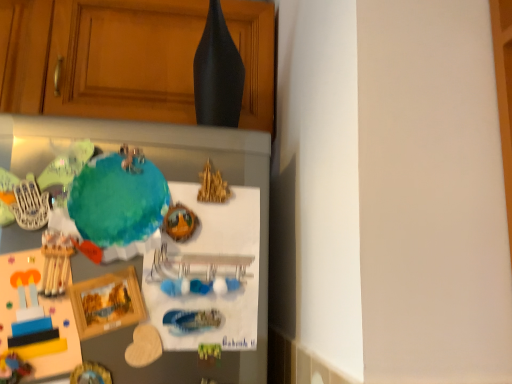
In order to face matte wood cabinet at upper center, should I rotate leftwards or rightwards?

To align with it, rotate left about 17.480°.

This screenshot has height=384, width=512. Describe the element at coordinates (101, 57) in the screenshot. I see `matte wood cabinet at upper center` at that location.

The height and width of the screenshot is (384, 512). What are the coordinates of `matte wood cabinet at upper center` in the screenshot? It's located at (101, 57).

Identify the location of teal matte globe at center. Image resolution: width=512 pixels, height=384 pixels. (118, 199).

Describe the element at coordinates (118, 199) in the screenshot. I see `teal matte globe at center` at that location.

The width and height of the screenshot is (512, 384). What are the coordinates of `matte wood cabinet at upper center` in the screenshot? It's located at (101, 57).

Would you say matte wood cabinet at upper center is to the left or to the right of teal matte globe at center in the picture?

matte wood cabinet at upper center is positioned on teal matte globe at center's left side.

Between matte wood cabinet at upper center and teal matte globe at center, which one is positioned behind?

matte wood cabinet at upper center is more distant.

Does point (56, 48) lie in front of point (102, 188)?

No.

From the image's perspective, between matte wood cabinet at upper center and teal matte globe at center, who is located below?

From the image's view, teal matte globe at center is below.

From a real-world perspective, who is located higher, matte wood cabinet at upper center or teal matte globe at center?

In real-world perspective, matte wood cabinet at upper center is above.

Considering the relative sizes of matte wood cabinet at upper center and teal matte globe at center in the image provided, is matte wood cabinet at upper center wider than teal matte globe at center?

Indeed, matte wood cabinet at upper center has a greater width compared to teal matte globe at center.

From the picture: Is matte wood cabinet at upper center taller than teal matte globe at center?

Indeed, matte wood cabinet at upper center has a greater height compared to teal matte globe at center.

Considering the relative sizes of matte wood cabinet at upper center and teal matte globe at center in the image provided, is matte wood cabinet at upper center smaller than teal matte globe at center?

Incorrect, matte wood cabinet at upper center is not smaller in size than teal matte globe at center.

Can we say matte wood cabinet at upper center lies outside teal matte globe at center?

Indeed, matte wood cabinet at upper center is completely outside teal matte globe at center.

Consider the image. Is matte wood cabinet at upper center beside teal matte globe at center?

No, matte wood cabinet at upper center is not in contact with teal matte globe at center.

Does matte wood cabinet at upper center turn towards teal matte globe at center?

No, matte wood cabinet at upper center is not oriented towards teal matte globe at center.

How much distance is there between matte wood cabinet at upper center and teal matte globe at center?

matte wood cabinet at upper center and teal matte globe at center are 18.86 inches apart.

Locate an element on the screen. This screenshot has width=512, height=384. cabinetry above the teal matte globe at center (from the image's perspective) is located at coordinates (101, 57).

Between teal matte globe at center and matte wood cabinet at upper center, which one appears on the right side from the viewer's perspective?

teal matte globe at center.

Considering the positions of objects teal matte globe at center and matte wood cabinet at upper center in the image provided, who is in front, teal matte globe at center or matte wood cabinet at upper center?

Positioned in front is teal matte globe at center.

Is point (90, 169) farther from viewer compared to point (127, 32)?

No, it is not.

From the image's perspective, which object appears higher, teal matte globe at center or matte wood cabinet at upper center?

matte wood cabinet at upper center.

From a real-world perspective, who is located lower, teal matte globe at center or matte wood cabinet at upper center?

In real-world perspective, teal matte globe at center is lower.

Considering the relative sizes of teal matte globe at center and matte wood cabinet at upper center in the image provided, is teal matte globe at center wider than matte wood cabinet at upper center?

Incorrect, the width of teal matte globe at center does not surpass that of matte wood cabinet at upper center.

In the scene shown: Which of these two, teal matte globe at center or matte wood cabinet at upper center, stands taller?

matte wood cabinet at upper center is taller.

Which of these two, teal matte globe at center or matte wood cabinet at upper center, is bigger?

With larger size is matte wood cabinet at upper center.

In the scene shown: Is matte wood cabinet at upper center inside teal matte globe at center?

No, matte wood cabinet at upper center is not a part of teal matte globe at center.

Based on the photo, are teal matte globe at center and matte wood cabinet at upper center beside each other?

No, teal matte globe at center is not beside matte wood cabinet at upper center.

Looking at this image, could you tell me if teal matte globe at center is facing matte wood cabinet at upper center?

No, teal matte globe at center does not turn towards matte wood cabinet at upper center.

How far apart are teal matte globe at center and matte wood cabinet at upper center?

They are 47.91 centimeters apart.

At what (x,y) coordinates should I click in order to perform the action: click on teal lying below the matte wood cabinet at upper center (from the image's perspective). Please return your answer as a coordinate pair (x, y). Looking at the image, I should click on (118, 199).

Locate an element on the screen. The image size is (512, 384). teal located in front of the matte wood cabinet at upper center is located at coordinates (118, 199).

I want to click on cabinetry above the teal matte globe at center (from the image's perspective), so tap(101, 57).